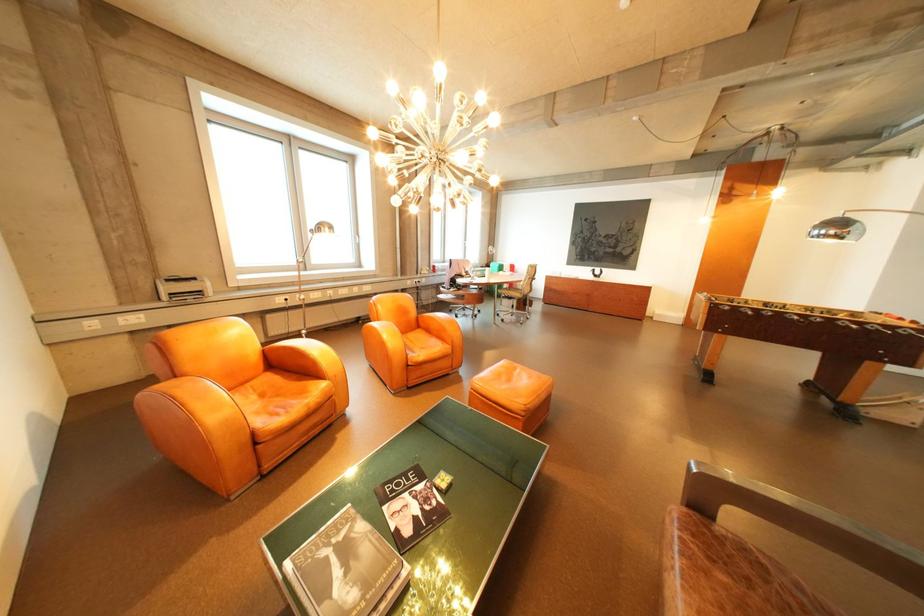
Which object does [183,288] point to?

It corresponds to the white office printer in the image.